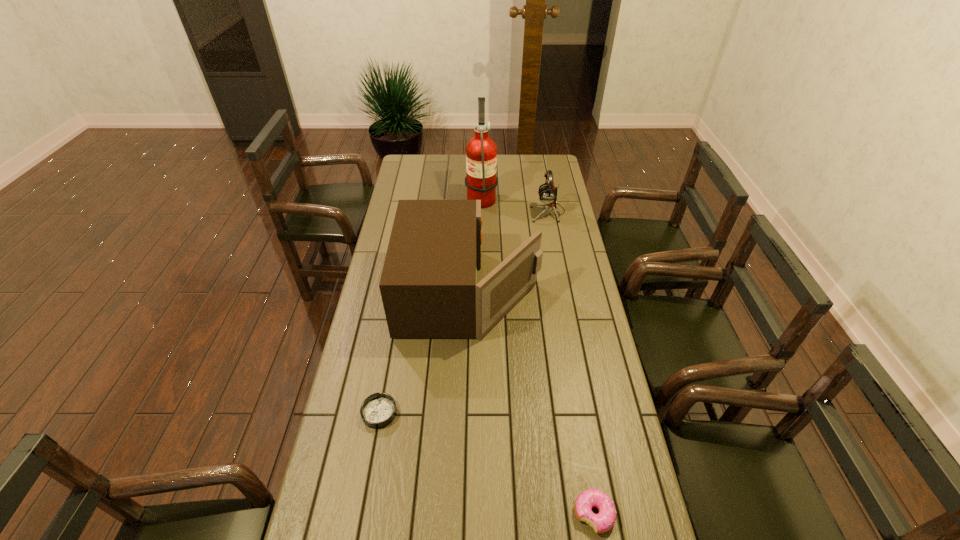
Identify the location of unoccupied position between the second tallest object and the shortest object. Image resolution: width=960 pixels, height=540 pixels. (424, 353).

Where is `object that ranks as the closest to the third shortest object`? Image resolution: width=960 pixels, height=540 pixels. object that ranks as the closest to the third shortest object is located at coordinates (481, 151).

You are a GUI agent. You are given a task and a screenshot of the screen. Output one action in this format:
    pyautogui.click(x=<x>, y=<y>)
    Task: Click on the object that is the third closest to the fourth shortest object
    The image size is (960, 540).
    Given the screenshot: What is the action you would take?
    pyautogui.click(x=481, y=151)

Identify the location of vacant space that satisfies the following two spatial constraints: 1. on the nozzle and handle of the tallest object; 2. on the left side of the nearest object. The width and height of the screenshot is (960, 540). (482, 514).

Image resolution: width=960 pixels, height=540 pixels. I want to click on free location that satisfies the following two spatial constraints: 1. on the nozzle and handle of the earphone; 2. on the right side of the tallest object, so click(x=481, y=212).

Find the location of a particular element. The width and height of the screenshot is (960, 540). blank area in the image that satisfies the following two spatial constraints: 1. on the back side of the nearest object; 2. on the nozzle and handle of the tallest object is located at coordinates (540, 197).

The width and height of the screenshot is (960, 540). Identify the location of free space that satisfies the following two spatial constraints: 1. on the nozzle and handle of the fire extinguisher; 2. on the left side of the earphone. (481, 212).

At what (x,y) coordinates should I click in order to perform the action: click on free space that satisfies the following two spatial constraints: 1. on the nozzle and handle of the fire extinguisher; 2. on the left side of the nearest object. Please return your answer as a coordinate pair (x, y). Looking at the image, I should click on (482, 514).